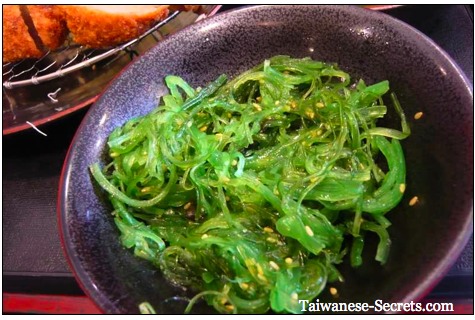
At what (x,y) coordinates should I click in order to perform the action: click on black bowl. Please return your answer as a coordinate pair (x, y). Image resolution: width=475 pixels, height=320 pixels. Looking at the image, I should click on (360, 35).